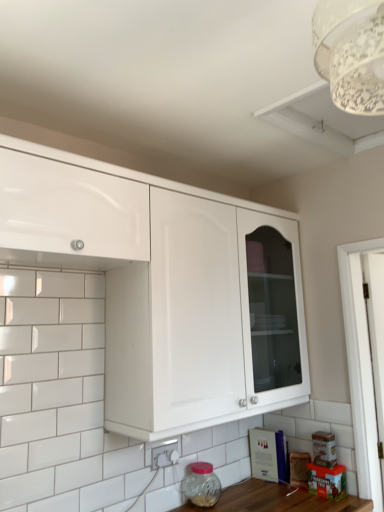
Question: In terms of size, does transparent glass jar at lower center appear bigger or smaller than white lace lampshade at upper right?

Choices:
 (A) big
 (B) small

Answer: (B)

Question: Relative to white lace lampshade at upper right, is transparent glass jar at lower center in front or behind?

Choices:
 (A) front
 (B) behind

Answer: (B)

Question: Considering the real-world distances, which object is farthest from the white lace lampshade at upper right?

Choices:
 (A) white glossy cabinet at upper center, placed as the second cabinetry when sorted from left to right
 (B) white glossy cabinet at upper left, acting as the 2th cabinetry starting from the right
 (C) white glossy electric outlet at lower center
 (D) transparent glass jar at lower center

Answer: (D)

Question: Which is farther from the white lace lampshade at upper right?

Choices:
 (A) white glossy cabinet at upper left, the first cabinetry positioned from the left
 (B) white glossy electric outlet at lower center
 (C) white glossy cabinet at upper center, which appears as the first cabinetry when viewed from the right
 (D) transparent glass jar at lower center

Answer: (D)